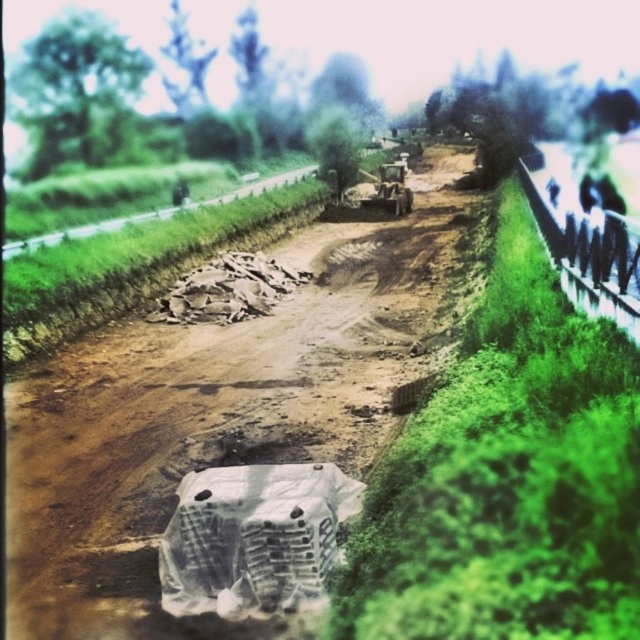
Can you confirm if brown sandy dirt track at center is taller than green plastic fence at right?

Incorrect, brown sandy dirt track at center's height is not larger of green plastic fence at right's.

Is point (166, 444) positioned behind point (618, 269)?

Yes.

Locate an element on the screen. brown sandy dirt track at center is located at coordinates (214, 413).

Can you confirm if green plastic fence at right is positioned below green plastic fence at center?

Correct, green plastic fence at right is located below green plastic fence at center.

Is green plastic fence at right in front of green plastic fence at center?

Yes, it is in front of green plastic fence at center.

Is point (596, 246) positioned before point (77, 236)?

Yes, point (596, 246) is closer to viewer.

In order to click on green plastic fence at right in this screenshot , I will do `click(588, 253)`.

Which is more to the right, brown sandy dirt track at center or green plastic fence at center?

brown sandy dirt track at center

Who is more distant from viewer, [86,476] or [214,198]?

The point [214,198] is behind.

Between point (230, 385) and point (60, 237), which one is positioned in front?

Positioned in front is point (230, 385).

You are a GUI agent. You are given a task and a screenshot of the screen. Output one action in this format:
    pyautogui.click(x=<x>, y=<y>)
    Task: Click on the brown sandy dirt track at center
    The height and width of the screenshot is (640, 640).
    Given the screenshot: What is the action you would take?
    pyautogui.click(x=214, y=413)